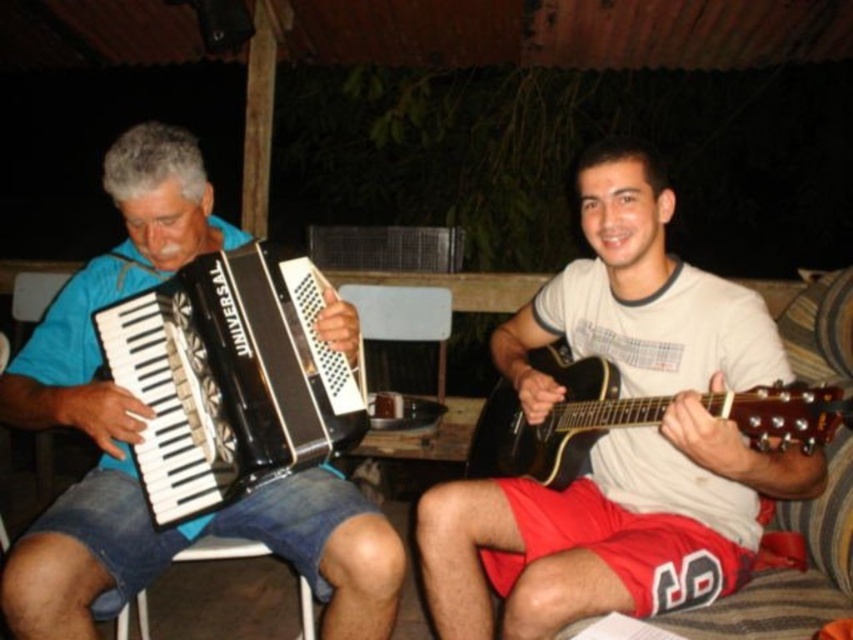
You are setting up a music stand between the black plastic accordion at left and the black glossy guitar at right. Since the stand requires at least 1 meter of space between the two instruments, will there be enough room?

The black plastic accordion at left is narrower than the black glossy guitar at right, but the description does not provide specific measurements to determine if the 1 meter requirement is met. Without exact dimensions, it is impossible to confirm if there is sufficient space.

You are a photographer trying to capture a closeup of the accordion and the guitar in the scene. You can only focus on one point at a time. Which point, point (360, 360) or point (589, 392), should you choose to ensure the accordion and the guitar are in focus?

Point (360, 360) is closer to the viewer than point (589, 392). Since the accordion and guitar are both in the foreground, focusing on the closer point will keep them in focus.

From the picture: You are a photographer trying to capture the white matte guitar at right. You need to position your camera at point A located at coordinates [619,436]. Is the white matte guitar at right visible from this point?

The white matte guitar at right is located exactly at point A, so yes, it will be clearly visible from that position.